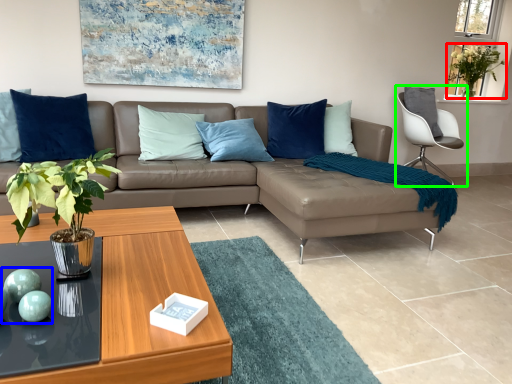
Question: Considering the real-world distances, which object is farthest from plant (highlighted by a red box)? teal (highlighted by a blue box) or chair (highlighted by a green box)?

Choices:
 (A) teal
 (B) chair

Answer: (A)